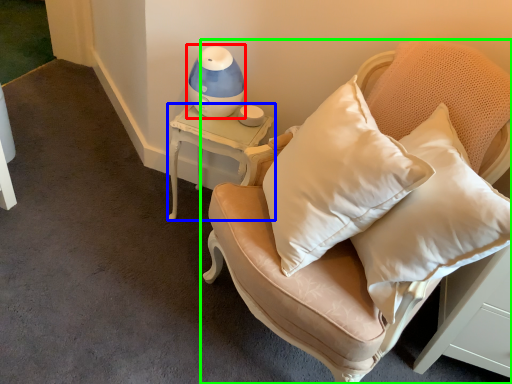
Question: Which object is the farthest from table lamp (highlighted by a red box)? Choose among these: table (highlighted by a blue box) or furniture (highlighted by a green box).

Choices:
 (A) table
 (B) furniture

Answer: (B)